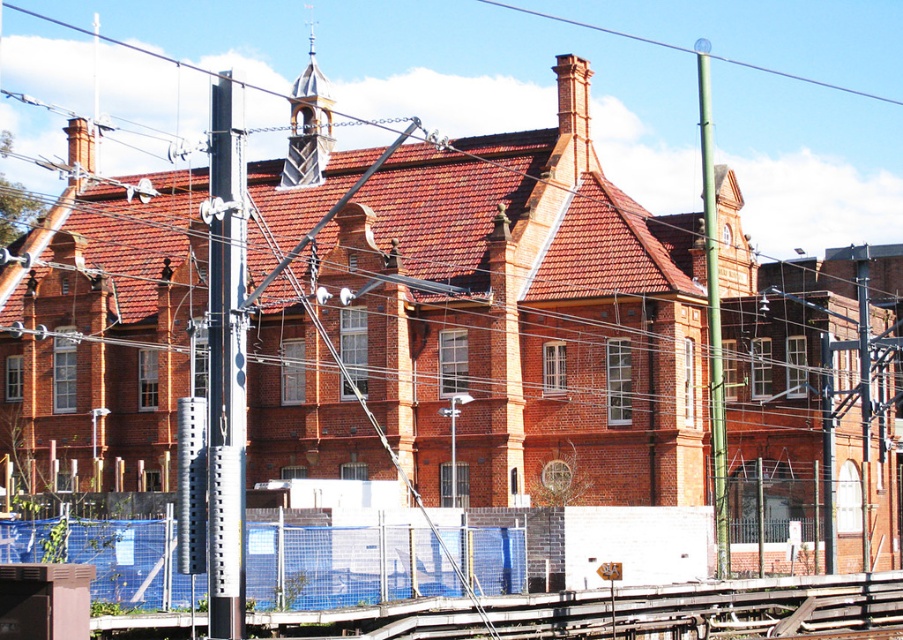
Consider the image. You are an electrician inspecting the power lines near the historic brick building. You notice the metallic gray pole at left and the metallic wire at upper center. Which object is smaller in size?

A: The metallic gray pole at left is smaller in size compared to the metallic wire at upper center.

You are a maintenance worker inspecting the electric infrastructure. You notice the green metallic pole at right and the metallic wire at upper center. Which object requires more material to construct based on their sizes?

The green metallic pole at right requires more material to construct than the metallic wire at upper center because it is larger in size.

You are a maintenance worker inspecting the overhead wires and poles near the historic brick building. You notice the metallic gray pole at left and the metallic wire at upper center. Which object is positioned higher from the ground?

The metallic wire at upper center is positioned higher from the ground than the metallic gray pole at left, as it is located above it.